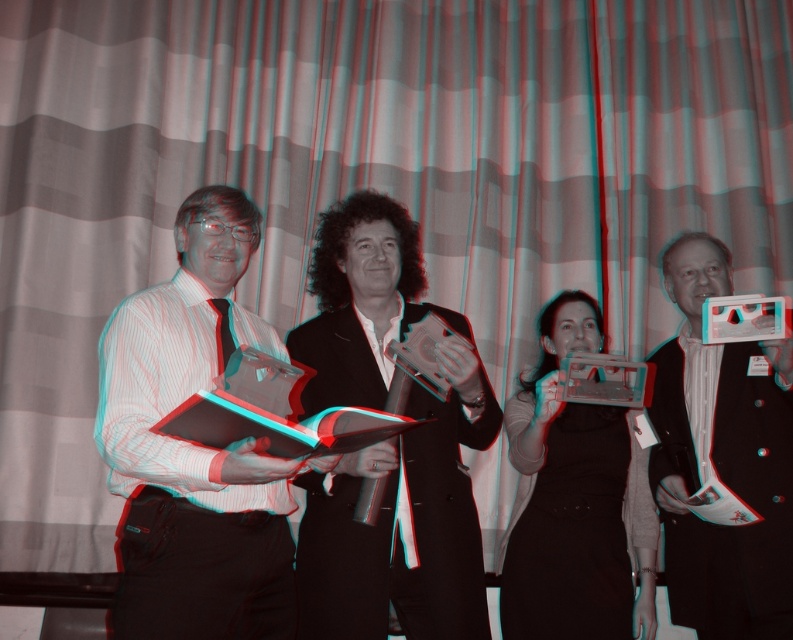
Is black glossy book at center below shiny silver award at center?

Actually, black glossy book at center is above shiny silver award at center.

Does black glossy book at center appear over shiny silver award at center?

Correct, black glossy book at center is located above shiny silver award at center.

Between point (405, 576) and point (780, 509), which one is positioned in front?

Point (405, 576)

Find the location of a particular element. Image resolution: width=793 pixels, height=640 pixels. black glossy book at center is located at coordinates (401, 525).

Does matte black book at left have a greater height compared to black glossy book at center?

In fact, matte black book at left may be shorter than black glossy book at center.

Who is higher up, matte black book at left or black glossy book at center?

Positioned higher is matte black book at left.

You are a GUI agent. You are given a task and a screenshot of the screen. Output one action in this format:
    pyautogui.click(x=<x>, y=<y>)
    Task: Click on the matte black book at left
    The height and width of the screenshot is (640, 793).
    Given the screenshot: What is the action you would take?
    pyautogui.click(x=193, y=448)

Can you confirm if matte black book at left is thinner than matte black dress at center?

No, matte black book at left is not thinner than matte black dress at center.

Is matte black book at left below matte black dress at center?

Actually, matte black book at left is above matte black dress at center.

This screenshot has height=640, width=793. What do you see at coordinates (193, 448) in the screenshot?
I see `matte black book at left` at bounding box center [193, 448].

You are a GUI agent. You are given a task and a screenshot of the screen. Output one action in this format:
    pyautogui.click(x=<x>, y=<y>)
    Task: Click on the matte black book at left
    
    Given the screenshot: What is the action you would take?
    pyautogui.click(x=193, y=448)